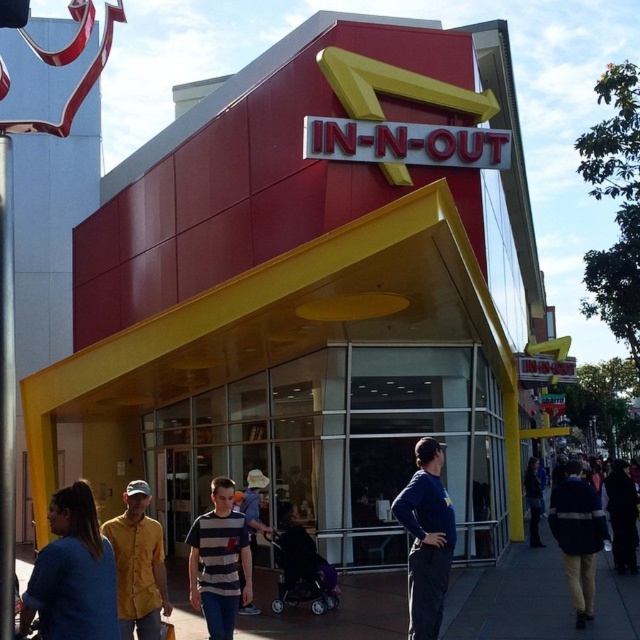
Question: Does striped cotton shirt at center appear on the right side of dark blue jacket at center?

Choices:
 (A) yes
 (B) no

Answer: (B)

Question: Can you confirm if blue cotton shirt at lower left is positioned to the left of striped shirt at center?

Choices:
 (A) no
 (B) yes

Answer: (B)

Question: Which is nearer to the striped cotton shirt at center?

Choices:
 (A) blue cotton shirt at lower left
 (B) dark gray concrete sidewalk at lower center

Answer: (A)

Question: Among these points, which one is nearest to the camera?

Choices:
 (A) (538, 492)
 (B) (636, 563)
 (C) (602, 522)
 (D) (246, 490)

Answer: (C)

Question: Can you confirm if dark blue fabric at center is positioned below striped cotton shirt at center?

Choices:
 (A) yes
 (B) no

Answer: (B)

Question: Which of the following is the closest to the observer?

Choices:
 (A) dark gray concrete sidewalk at lower center
 (B) dark blue jacket at center
 (C) striped shirt at center

Answer: (B)